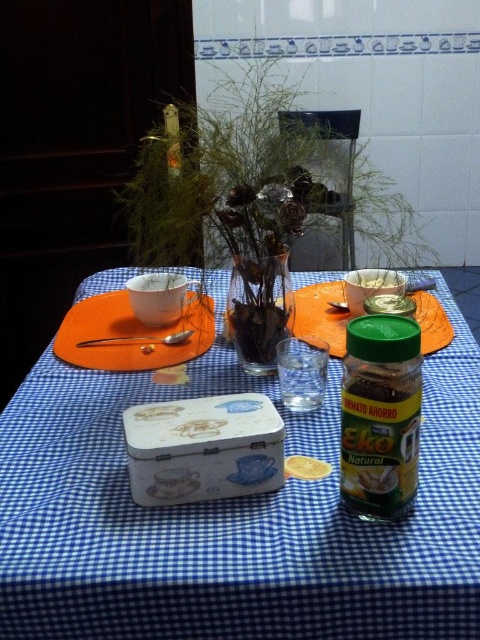
Does point (121, 326) come farther from viewer compared to point (116, 340)?

Yes, it is behind point (116, 340).

Identify the location of orange felt placemat at center. This screenshot has width=480, height=640. (131, 333).

Does yellow powder at center come behind silver spoon at left?

No, yellow powder at center is in front of silver spoon at left.

Consider the image. Is yellow powder at center taller than silver spoon at left?

No, yellow powder at center is not taller than silver spoon at left.

Who is more forward, (310, 477) or (147, 339)?

Positioned in front is point (310, 477).

At what (x,y) coordinates should I click in order to perform the action: click on yellow powder at center. Please return your answer as a coordinate pair (x, y). Image resolution: width=480 pixels, height=640 pixels. Looking at the image, I should click on (305, 467).

Who is positioned more to the right, green plastic container at center or silver spoon at left?

From the viewer's perspective, green plastic container at center appears more on the right side.

Find the location of a particular element. green plastic container at center is located at coordinates (322, 316).

Who is more distant from viewer, [297,332] or [96,340]?

Positioned behind is point [297,332].

The width and height of the screenshot is (480, 640). In order to click on green plastic container at center in this screenshot , I will do `click(322, 316)`.